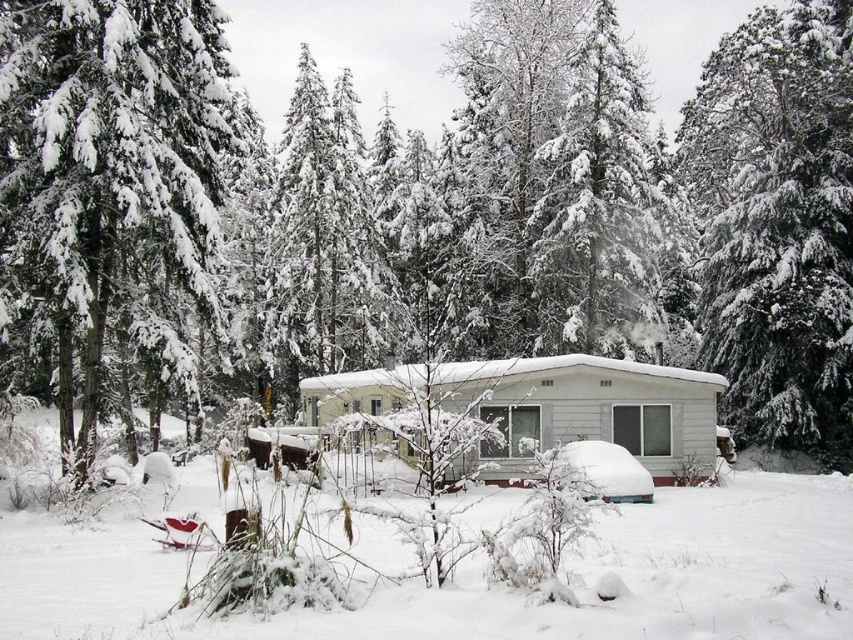
Question: Which object appears closest to the camera in this image?

Choices:
 (A) white matte cabin at center
 (B) snow-covered evergreen at left
 (C) white fluffy snow at center

Answer: (C)

Question: Which is farther from the snow-covered evergreen at upper right?

Choices:
 (A) snow-covered evergreen at center
 (B) white fluffy snow at center
 (C) white matte cabin at center
 (D) snow-covered evergreen at left

Answer: (D)

Question: Can you confirm if snow-covered evergreen at left is positioned above white fluffy snow at center?

Choices:
 (A) no
 (B) yes

Answer: (B)

Question: Does white fluffy snow at center appear over snow-covered evergreen at upper right?

Choices:
 (A) no
 (B) yes

Answer: (A)

Question: Which point is closer to the camera?

Choices:
 (A) (793, 593)
 (B) (22, 163)
 (C) (534, 352)

Answer: (A)

Question: Is the position of snow-covered evergreen at left more distant than that of snow-covered evergreen at upper right?

Choices:
 (A) yes
 (B) no

Answer: (B)